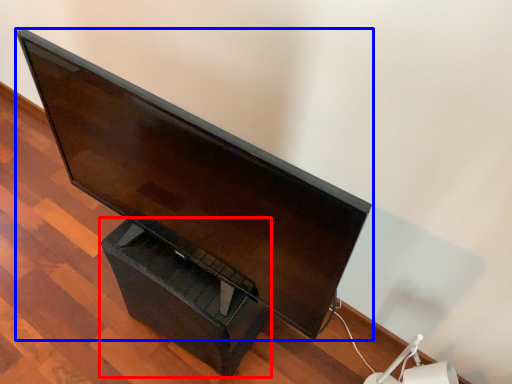
Question: Which object is closer to the camera taking this photo, drawer (highlighted by a red box) or computer monitor (highlighted by a blue box)?

Choices:
 (A) drawer
 (B) computer monitor

Answer: (B)